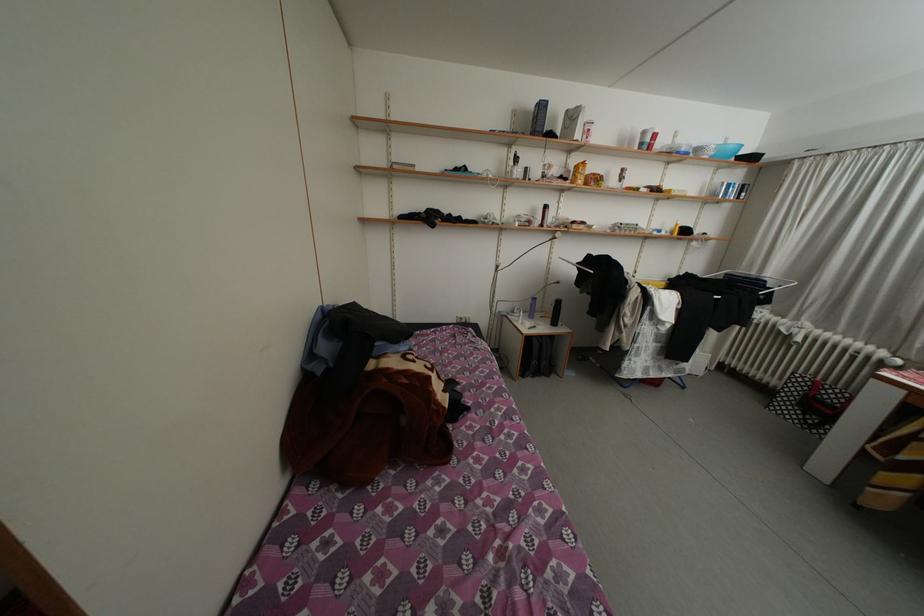
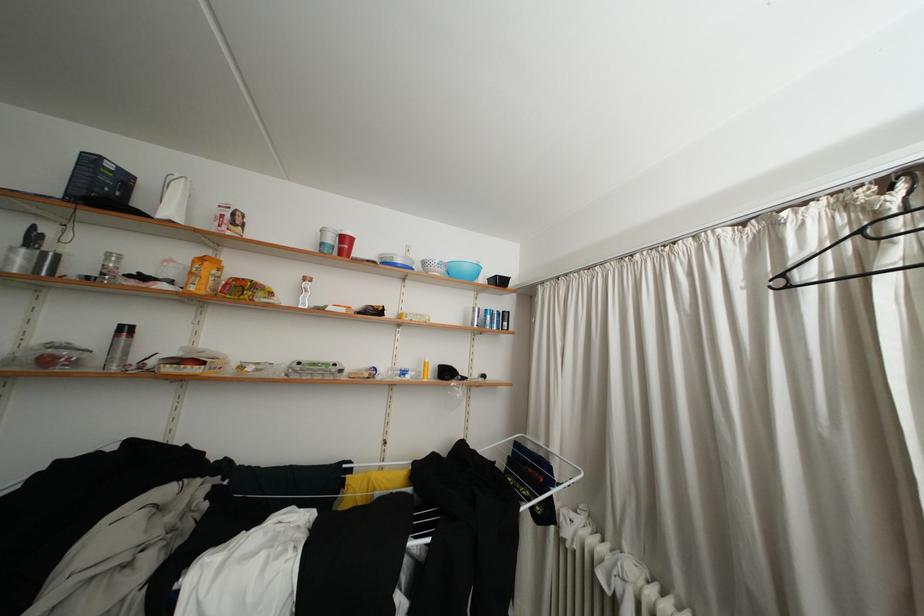
Question: I am providing you with two images of the same scene from different viewpoints. Please identify which objects are invisible in image2.

Choices:
 (A) red plastic cup
 (B) light blue bowl
 (C) blue spray can
 (D) none of these

Answer: (D)